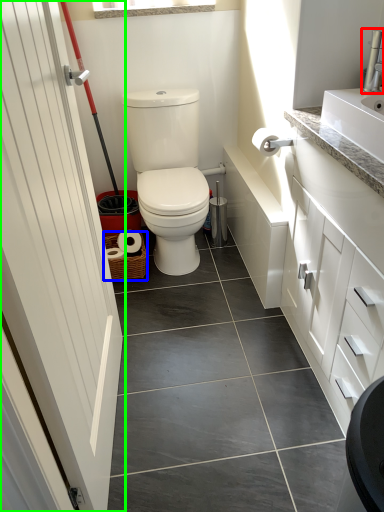
Question: Estimate the real-world distances between objects in this image. Which object is farther from faucet (highlighted by a red box), basket (highlighted by a blue box) or door (highlighted by a green box)?

Choices:
 (A) basket
 (B) door

Answer: (A)